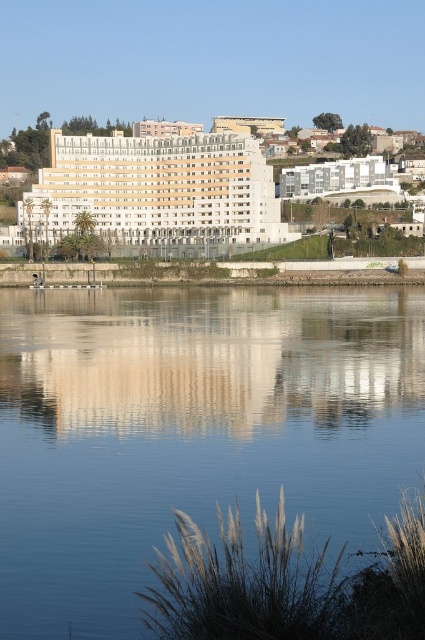
Question: Which of the following is the closest to the observer?

Choices:
 (A) (187, 448)
 (B) (192, 179)

Answer: (A)

Question: In this image, where is blue glassy water at center located relative to white smooth building at center?

Choices:
 (A) above
 (B) below

Answer: (B)

Question: Which point is closer to the camera taking this photo?

Choices:
 (A) (56, 170)
 (B) (382, 324)

Answer: (B)

Question: Which object is farther from the camera taking this photo?

Choices:
 (A) white smooth building at center
 (B) blue glassy water at center

Answer: (A)

Question: Can you confirm if blue glassy water at center is positioned below white smooth building at center?

Choices:
 (A) no
 (B) yes

Answer: (B)

Question: Considering the relative positions of blue glassy water at center and white smooth building at center in the image provided, where is blue glassy water at center located with respect to white smooth building at center?

Choices:
 (A) above
 (B) below

Answer: (B)